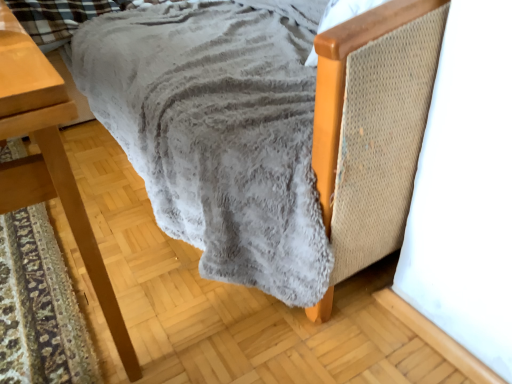
Where is `blank area beneath wooden table at left (from a real-world perspective)`? This screenshot has width=512, height=384. blank area beneath wooden table at left (from a real-world perspective) is located at coordinates (42, 275).